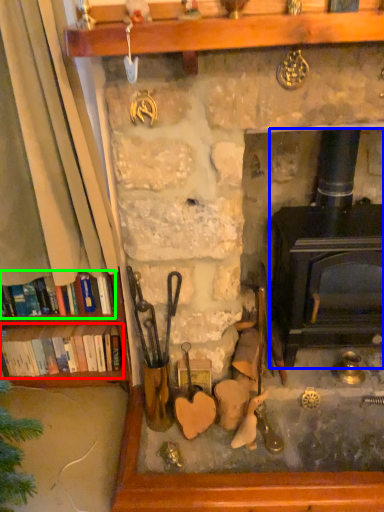
Question: Based on their relative distances, which object is nearer to book (highlighted by a red box)? Choose from wood burning stove (highlighted by a blue box) and book (highlighted by a green box).

Choices:
 (A) wood burning stove
 (B) book

Answer: (B)